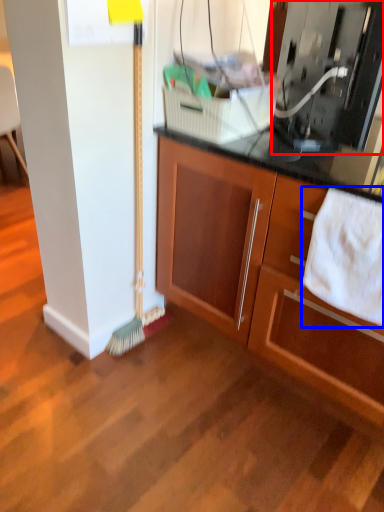
Question: Which of the following is the closest to the observer, appliance (highlighted by a red box) or bath towel (highlighted by a blue box)?

Choices:
 (A) appliance
 (B) bath towel

Answer: (A)